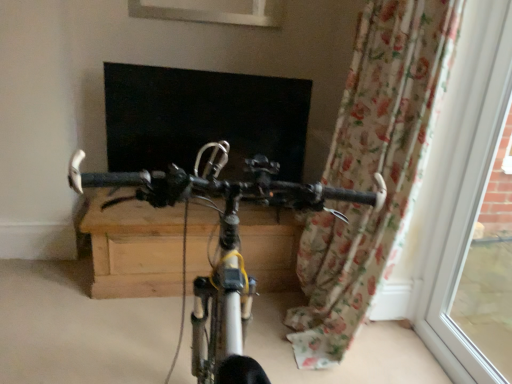
Question: Does white plastic window frame at right have a lesser width compared to metallic silver bicycle at center?

Choices:
 (A) no
 (B) yes

Answer: (B)

Question: Could you tell me if white plastic window frame at right is facing metallic silver bicycle at center?

Choices:
 (A) no
 (B) yes

Answer: (B)

Question: Is white plastic window frame at right to the left of metallic silver bicycle at center from the viewer's perspective?

Choices:
 (A) yes
 (B) no

Answer: (B)

Question: Can you confirm if white plastic window frame at right is taller than metallic silver bicycle at center?

Choices:
 (A) yes
 (B) no

Answer: (A)

Question: Does white plastic window frame at right touch metallic silver bicycle at center?

Choices:
 (A) yes
 (B) no

Answer: (B)

Question: Is white plastic window frame at right located outside metallic silver bicycle at center?

Choices:
 (A) no
 (B) yes

Answer: (B)

Question: Considering the relative sizes of white plastic window frame at right and floral fabric curtain at right in the image provided, is white plastic window frame at right bigger than floral fabric curtain at right?

Choices:
 (A) yes
 (B) no

Answer: (B)

Question: From the image's perspective, would you say white plastic window frame at right is positioned over floral fabric curtain at right?

Choices:
 (A) no
 (B) yes

Answer: (A)

Question: Is white plastic window frame at right looking in the opposite direction of floral fabric curtain at right?

Choices:
 (A) no
 (B) yes

Answer: (A)

Question: From a real-world perspective, does white plastic window frame at right sit lower than floral fabric curtain at right?

Choices:
 (A) yes
 (B) no

Answer: (A)

Question: Does white plastic window frame at right lie behind floral fabric curtain at right?

Choices:
 (A) no
 (B) yes

Answer: (A)

Question: Is white plastic window frame at right with floral fabric curtain at right?

Choices:
 (A) no
 (B) yes

Answer: (A)

Question: Is floral fabric curtain at right positioned beyond the bounds of metallic silver bicycle at center?

Choices:
 (A) no
 (B) yes

Answer: (B)